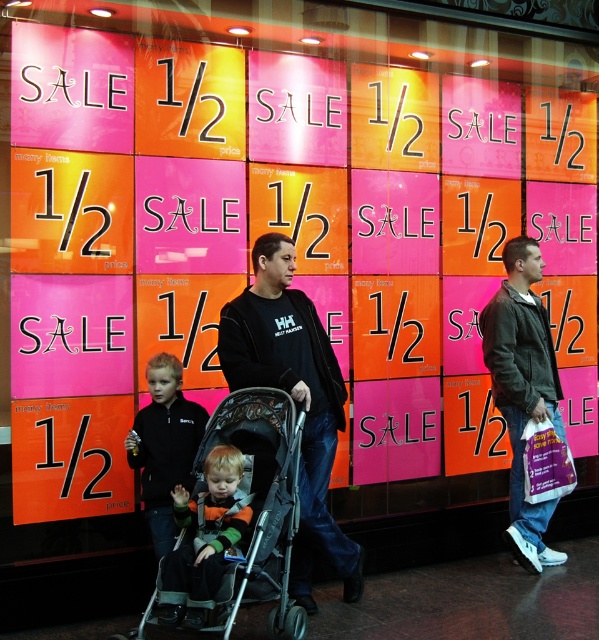
Image resolution: width=599 pixels, height=640 pixels. Describe the element at coordinates (294, 397) in the screenshot. I see `black softshell jacket at center` at that location.

Does point (283, 262) come farther from viewer compared to point (228, 428)?

That is True.

Does point (238, 348) come in front of point (301, 636)?

No, it is behind (301, 636).

The width and height of the screenshot is (599, 640). I want to click on black softshell jacket at center, so click(x=294, y=397).

Who is higher up, black textured stroller at center or dark green jacket at right?

dark green jacket at right

Is black textured stroller at center positioned at the back of dark green jacket at right?

That is False.

In order to click on black textured stroller at center in this screenshot , I will do `click(247, 524)`.

At what (x,y) coordinates should I click in order to perform the action: click on black textured stroller at center. Please return your answer as a coordinate pair (x, y). Image resolution: width=599 pixels, height=640 pixels. Looking at the image, I should click on (247, 524).

Is green fleece jacket at center thinner than black fleece jacket at center?

Incorrect, green fleece jacket at center's width is not less than black fleece jacket at center's.

Does green fleece jacket at center have a greater width compared to black fleece jacket at center?

Yes.

What do you see at coordinates (208, 525) in the screenshot? I see `green fleece jacket at center` at bounding box center [208, 525].

This screenshot has width=599, height=640. In order to click on green fleece jacket at center in this screenshot , I will do `click(208, 525)`.